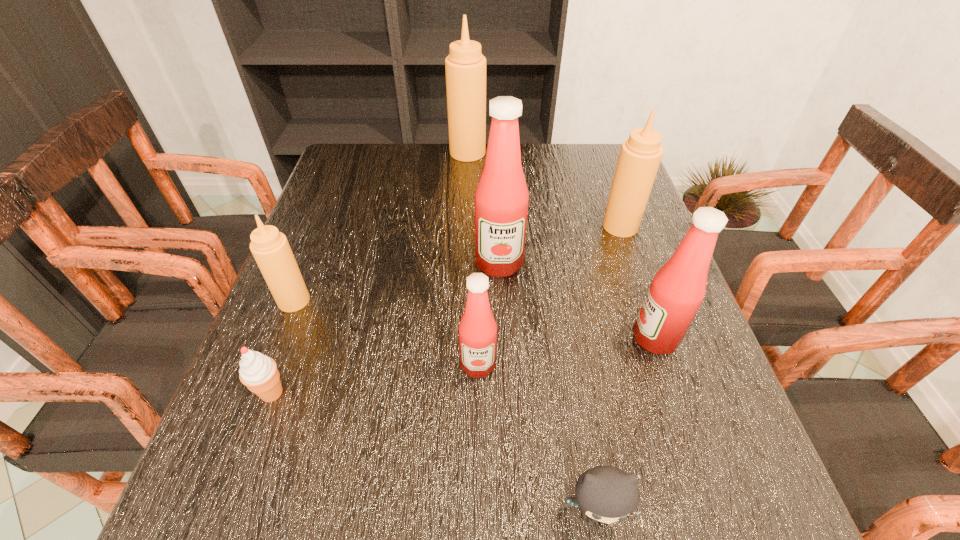
Find the location of `icecream`. icecream is located at coordinates (258, 372).

Where is `kitten`? kitten is located at coordinates (606, 494).

The image size is (960, 540). Find the location of `the sixth object from left to right`. the sixth object from left to right is located at coordinates (606, 494).

Locate an element on the screen. vacant space located 0.320m on the front of the farthest condiment is located at coordinates (465, 233).

At what (x,y) coordinates should I click in order to perform the action: click on free location located on the front-facing side of the farthest red condiment. Please return your answer as a coordinate pair (x, y). The height and width of the screenshot is (540, 960). Looking at the image, I should click on (503, 362).

Locate an element on the screen. The width and height of the screenshot is (960, 540). vacant position located 0.330m on the left of the second farthest object is located at coordinates [469, 226].

Find the location of a particular element. The image size is (960, 540). vacant space located on the front-facing side of the second smallest red condiment is located at coordinates (489, 338).

Locate an element on the screen. The image size is (960, 540). vacant space located 0.120m on the front-facing side of the second smallest red condiment is located at coordinates (571, 338).

This screenshot has width=960, height=540. I want to click on free space located 0.200m on the front-facing side of the second smallest red condiment, so click(530, 338).

At what (x,y) coordinates should I click in order to perform the action: click on vacant point located 0.080m on the right of the fifth nearest object. Please return your answer as a coordinate pair (x, y). Looking at the image, I should click on (348, 301).